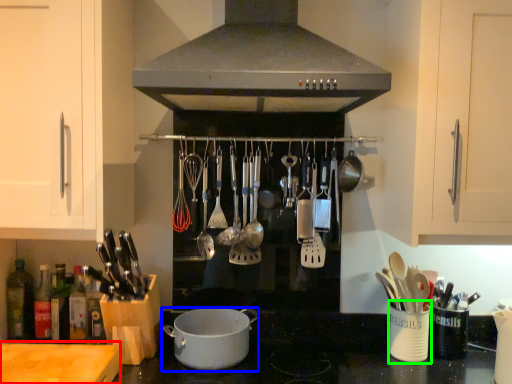
Question: Estimate the real-world distances between objects in this image. Which object is farther from counter top (highlighted by a red box), kitchen appliance (highlighted by a blue box) or appliance (highlighted by a green box)?

Choices:
 (A) kitchen appliance
 (B) appliance

Answer: (B)